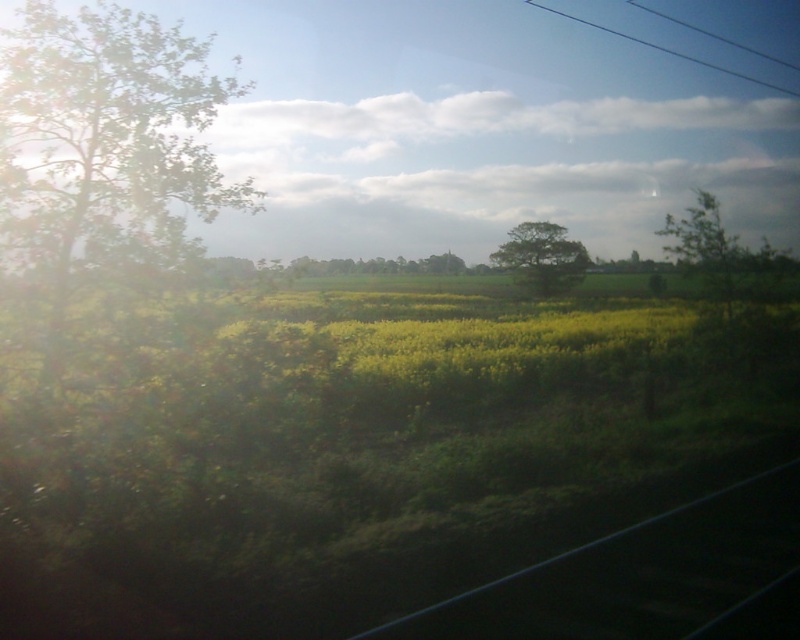
Question: Can you confirm if green leafy tree at left is wider than green leafy tree at center?

Choices:
 (A) no
 (B) yes

Answer: (B)

Question: Estimate the real-world distances between objects in this image. Which object is closer to the green leafy tree at center?

Choices:
 (A) green leafy tree at upper right
 (B) green leafy tree at left
 (C) black metal train track at lower right

Answer: (B)

Question: Which object is closer to the camera taking this photo?

Choices:
 (A) green leafy tree at center
 (B) black metal train track at lower right
 (C) green leafy tree at upper right
 (D) green leafy tree at left

Answer: (B)

Question: Is black metal train track at lower right above black wire at upper center?

Choices:
 (A) no
 (B) yes

Answer: (A)

Question: Which point is closer to the camera taking this photo?

Choices:
 (A) (10, 131)
 (B) (541, 284)
 (C) (756, 257)

Answer: (A)

Question: Is green leafy tree at left in front of black wire at upper center?

Choices:
 (A) yes
 (B) no

Answer: (A)